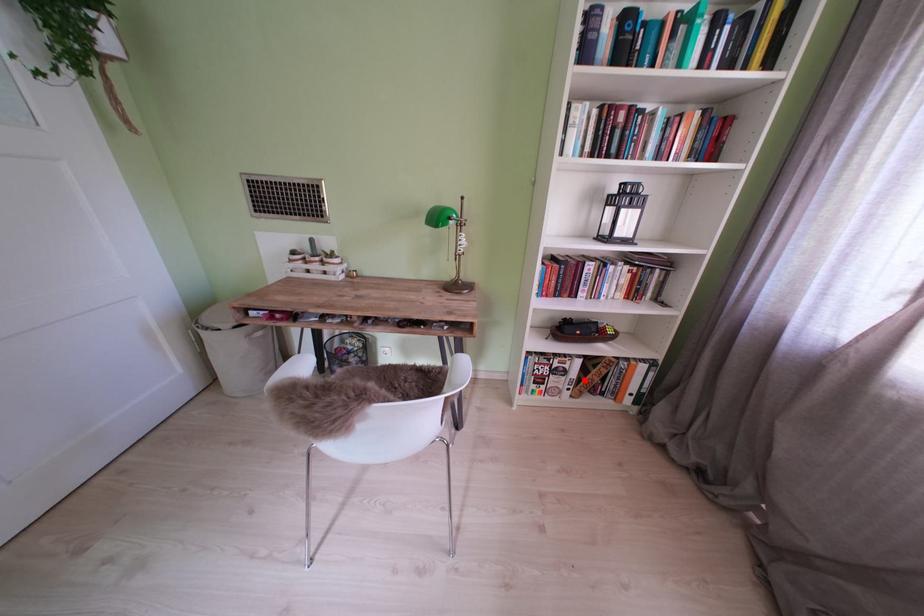
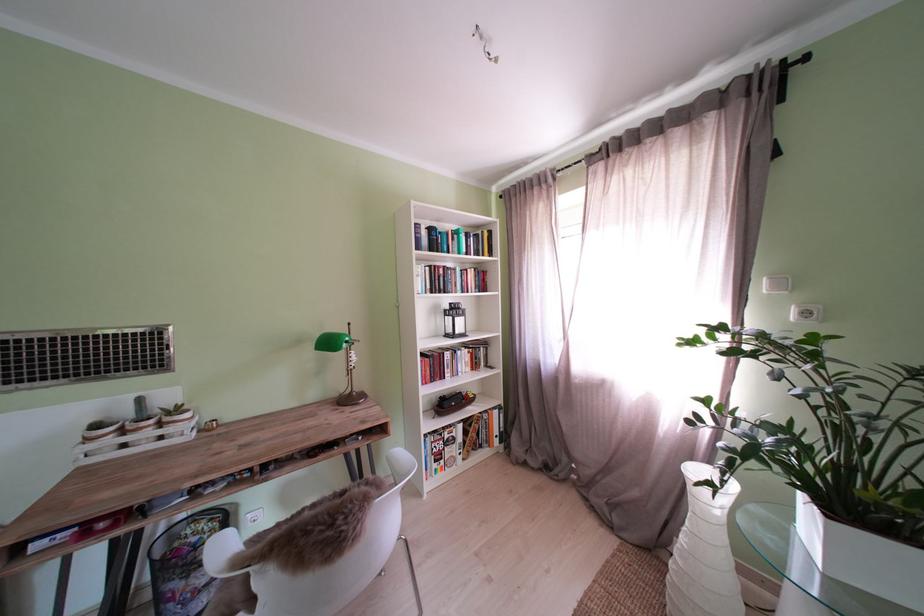
In the second image, find the point that corresponds to the highlighted location in the first image.

(470, 444)